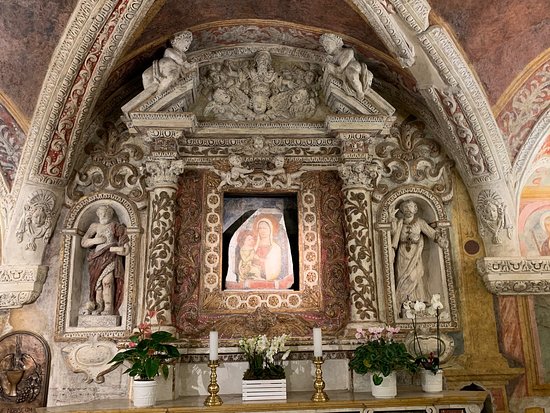
Image resolution: width=550 pixels, height=413 pixels. I want to click on brown ceiling, so click(502, 42), click(328, 17), click(29, 28).